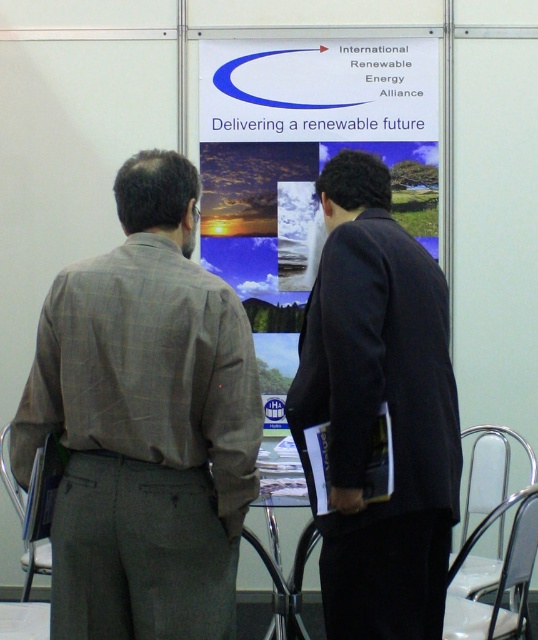
Question: Is gray checkered shirt at left to the right of metallic silver chair at lower left from the viewer's perspective?

Choices:
 (A) yes
 (B) no

Answer: (A)

Question: Which of the following is the farthest from the observer?

Choices:
 (A) white paperboard at center
 (B) gray checkered shirt at left
 (C) metallic silver chair at lower left
 (D) black matte suit at center

Answer: (A)

Question: Is black matte suit at center thinner than white paperboard at center?

Choices:
 (A) yes
 (B) no

Answer: (A)

Question: In this image, where is gray checkered shirt at left located relative to black matte suit at center?

Choices:
 (A) right
 (B) left

Answer: (B)

Question: Which object is the farthest from the black matte suit at center?

Choices:
 (A) gray checkered shirt at left
 (B) white paperboard at center
 (C) metallic silver chair at lower right

Answer: (B)

Question: Which point is farther to the camera?

Choices:
 (A) metallic silver chair at lower right
 (B) white paperboard at center
 (C) metallic silver chair at lower left
 (D) black matte suit at center

Answer: (B)